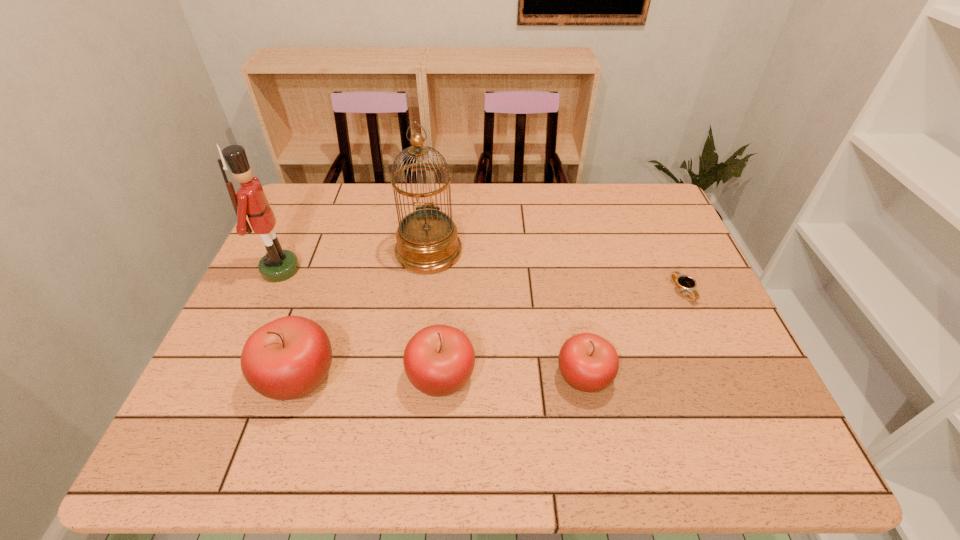
Find the location of a particular element. The width and height of the screenshot is (960, 540). free space located 0.290m on the back of the second shortest apple is located at coordinates (449, 264).

In order to click on vacant space located on the back of the second object from right to left in this screenshot , I will do `click(570, 307)`.

The height and width of the screenshot is (540, 960). Identify the location of blank space located with an open door on the birdcage. (423, 300).

I want to click on vacant space located 0.260m on the front-facing side of the leftmost object, so click(x=394, y=269).

Identify the location of free space located on the left of the shortest object. This screenshot has width=960, height=540. (596, 291).

Identify the location of apple that is at the left edge. This screenshot has height=540, width=960. (288, 358).

This screenshot has height=540, width=960. What are the coordinates of `nutcracker that is at the left edge` in the screenshot? It's located at (277, 265).

Identify the location of object present at the right edge. (682, 282).

Where is `object present at the near left corner`? object present at the near left corner is located at coordinates (288, 358).

The height and width of the screenshot is (540, 960). In the image, there is a desktop. In order to click on vacant area at the far edge in this screenshot , I will do `click(539, 224)`.